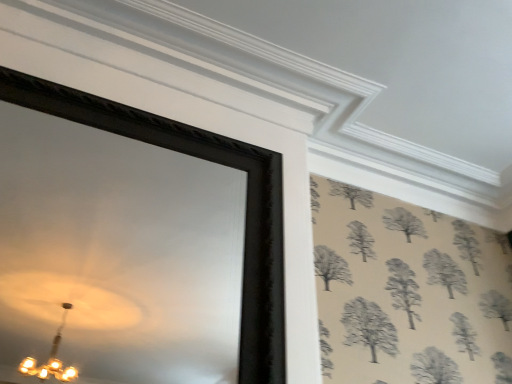
In the scene shown: In order to face black wood picture frame at upper left, should I rotate leftwards or rightwards?

To align with it, rotate left about 16.478°.

You are a GUI agent. You are given a task and a screenshot of the screen. Output one action in this format:
    pyautogui.click(x=<x>, y=<y>)
    Task: Click on the black wood picture frame at upper left
    
    Given the screenshot: What is the action you would take?
    pyautogui.click(x=211, y=161)

The width and height of the screenshot is (512, 384). Describe the element at coordinates (211, 161) in the screenshot. I see `black wood picture frame at upper left` at that location.

Locate an element on the screen. black wood picture frame at upper left is located at coordinates (211, 161).